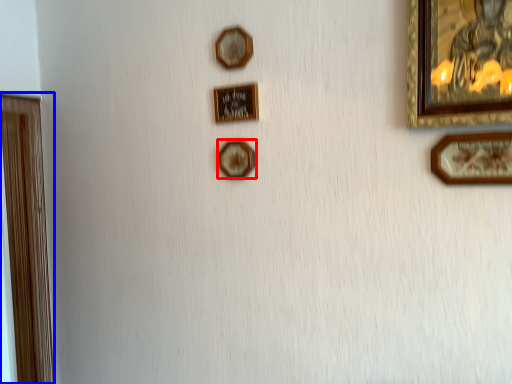
Question: Among these objects, which one is nearest to the camera, picture frame (highlighted by a red box) or picture frame (highlighted by a blue box)?

Choices:
 (A) picture frame
 (B) picture frame

Answer: (A)